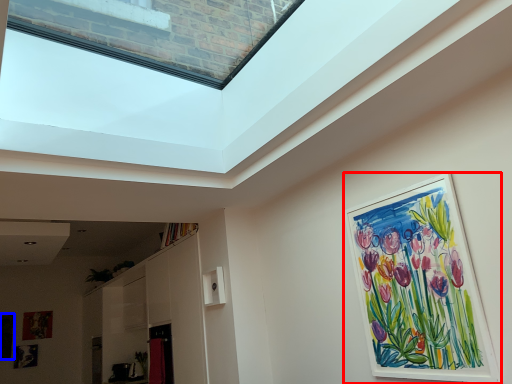
Question: Which object appears closest to the camera in this image, picture frame (highlighted by a red box) or picture frame (highlighted by a blue box)?

Choices:
 (A) picture frame
 (B) picture frame

Answer: (A)